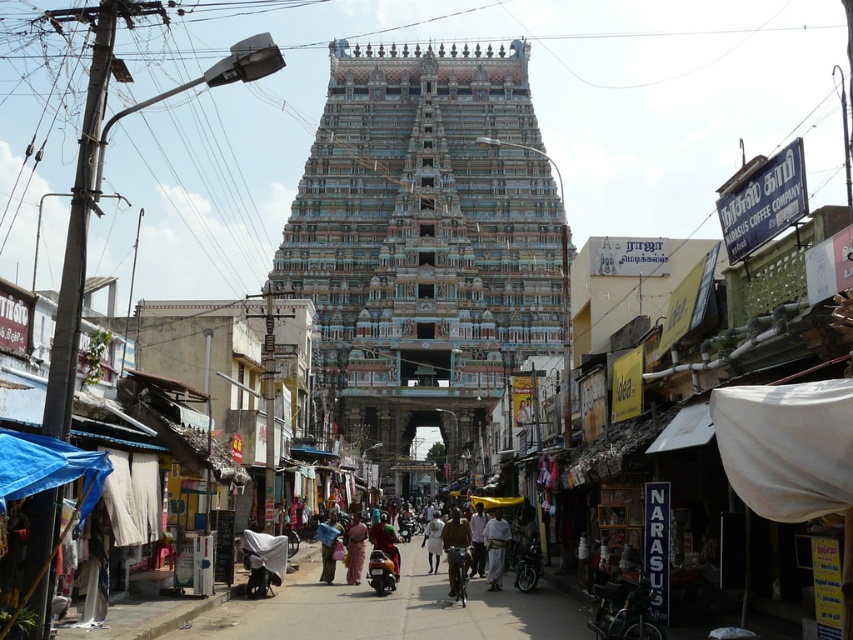
What do you see at coordinates (328, 545) in the screenshot? I see `blue fabric at center` at bounding box center [328, 545].

Which is above, blue fabric at center or dark skin human at center?

dark skin human at center

Where is `blue fabric at center`? The image size is (853, 640). blue fabric at center is located at coordinates (328, 545).

Where is `blue fabric at center`? Image resolution: width=853 pixels, height=640 pixels. blue fabric at center is located at coordinates coord(328,545).

From the picture: Is blue fabric at center taller than multicolored saree at center?

No, blue fabric at center is not taller than multicolored saree at center.

In the scene shown: Which of these two, blue fabric at center or multicolored saree at center, stands shorter?

blue fabric at center

Does point (340, 524) come closer to viewer compared to point (357, 544)?

No, it is not.

This screenshot has height=640, width=853. Find the location of `blue fabric at center`. blue fabric at center is located at coordinates (328, 545).

Does point (1, 440) lie behind point (331, 515)?

No, it is not.

Is blue tarpaulin canopy at lower left bigger than blue fabric at center?

Yes, blue tarpaulin canopy at lower left is bigger than blue fabric at center.

Who is more forward, [50,454] or [329,579]?

Point [50,454]

At what (x,y) coordinates should I click in order to perform the action: click on blue tarpaulin canopy at lower left. Please return your answer as a coordinate pair (x, y). This screenshot has height=640, width=853. Looking at the image, I should click on (47, 467).